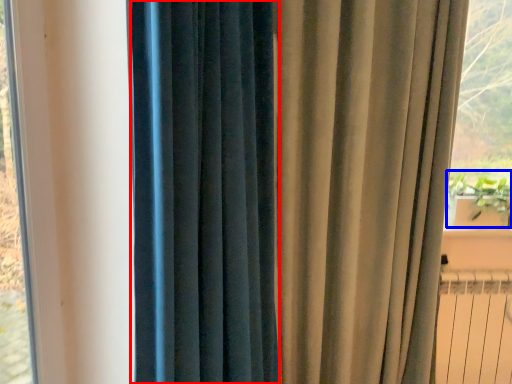
Question: Which object is closer to the camera taking this photo, curtain (highlighted by a red box) or plant (highlighted by a blue box)?

Choices:
 (A) curtain
 (B) plant

Answer: (A)